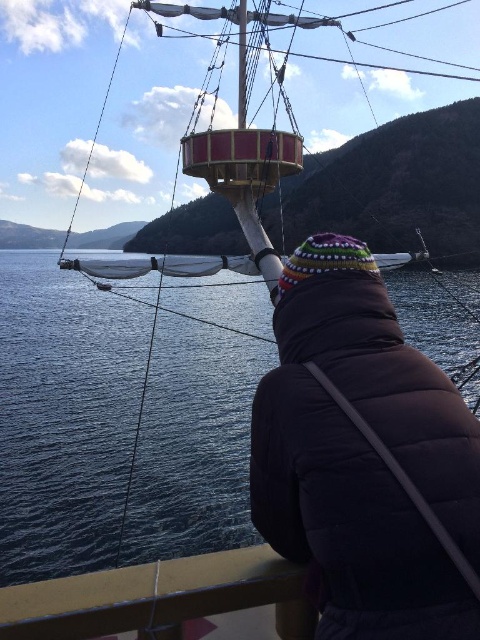
Question: Considering the relative positions of multicolored knit hat at center and brown wooden deck at lower center in the image provided, where is multicolored knit hat at center located with respect to brown wooden deck at lower center?

Choices:
 (A) left
 (B) right

Answer: (B)

Question: Which point is closer to the camera?

Choices:
 (A) (384, 422)
 (B) (17, 616)
 (C) (204, 474)

Answer: (B)

Question: Is blue water at center wider than brown wooden deck at lower center?

Choices:
 (A) yes
 (B) no

Answer: (A)

Question: Which point is farther from the camera taking this photo?

Choices:
 (A) (95, 637)
 (B) (118, 518)
 (C) (460, 552)

Answer: (B)

Question: Considering the real-world distances, which object is closest to the brown wooden deck at lower center?

Choices:
 (A) blue water at center
 (B) multicolored knit hat at center

Answer: (B)

Question: Does multicolored knit hat at center lie behind brown wooden deck at lower center?

Choices:
 (A) yes
 (B) no

Answer: (B)